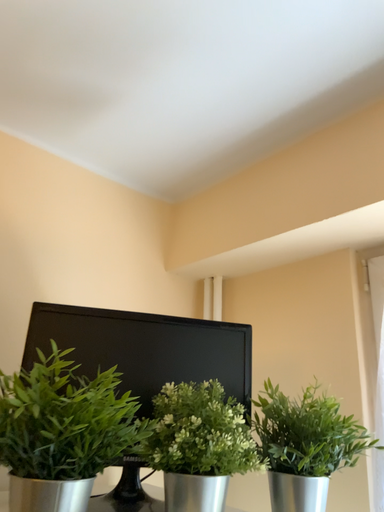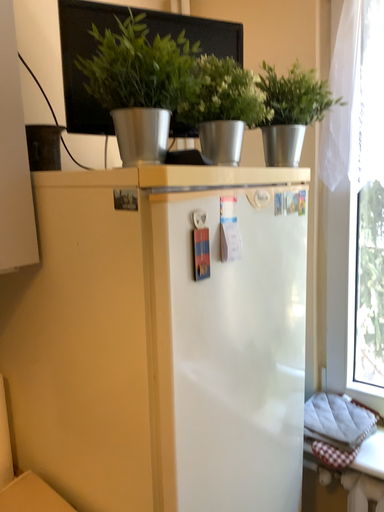
Question: How did the camera likely rotate when shooting the video?

Choices:
 (A) rotated right
 (B) rotated left

Answer: (A)